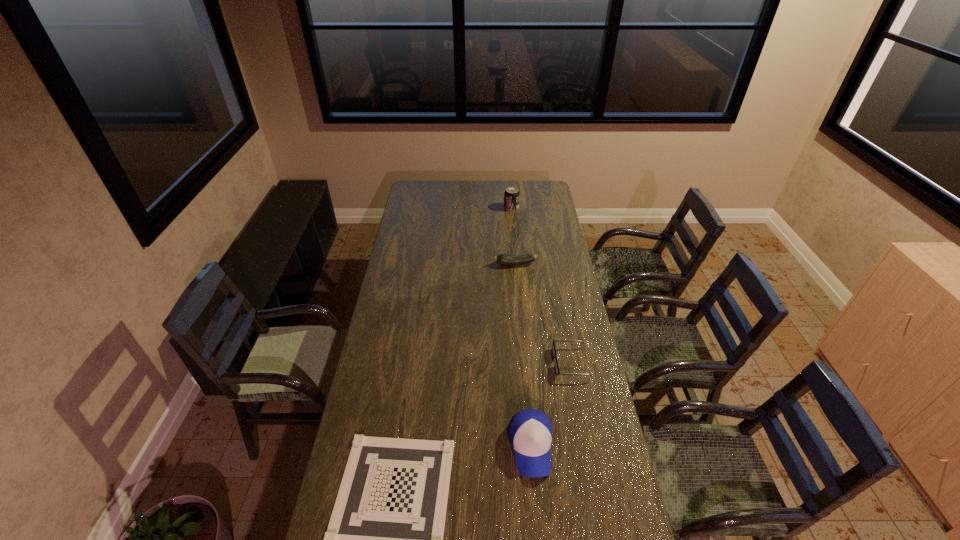
This screenshot has height=540, width=960. In order to click on free space in the image that satisfies the following two spatial constraints: 1. at the blossom end of the zucchini; 2. on the front-facing side of the second tallest object in this screenshot , I will do `click(533, 447)`.